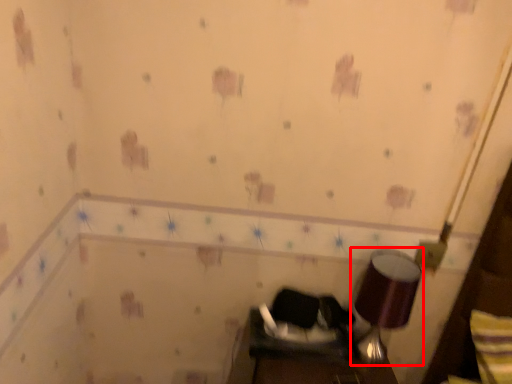
Question: From the image, what is the correct spatial relationship of lamp (annotated by the red box) in relation to swivel chair?

Choices:
 (A) right
 (B) left

Answer: (A)